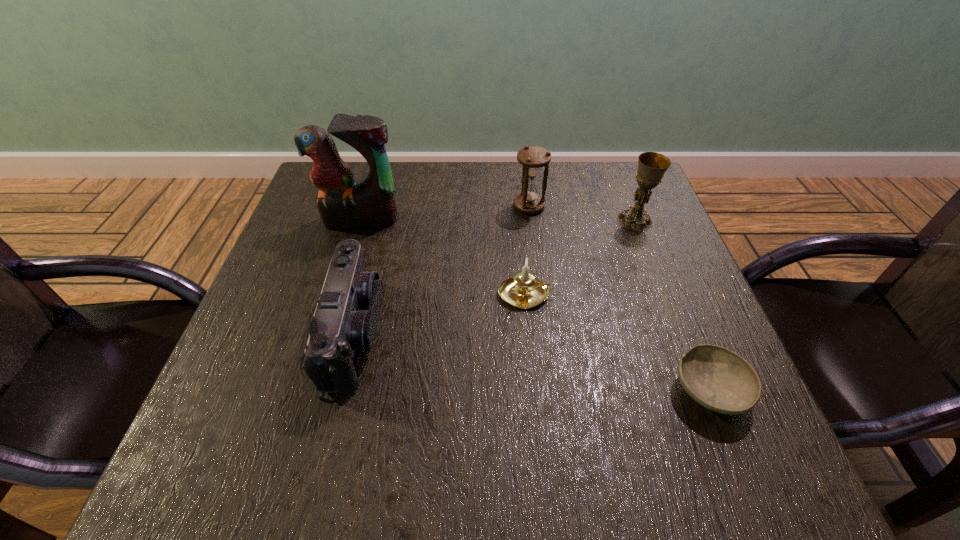
The height and width of the screenshot is (540, 960). In order to click on empty location between the hourglass and the bowl in this screenshot , I will do `click(619, 299)`.

The height and width of the screenshot is (540, 960). I want to click on vacant region between the bowl and the candle holder, so click(618, 342).

You are a GUI agent. You are given a task and a screenshot of the screen. Output one action in this format:
    pyautogui.click(x=<x>, y=<y>)
    Task: Click on the free space between the second shortest object and the hourglass
    The height and width of the screenshot is (540, 960).
    Given the screenshot: What is the action you would take?
    pyautogui.click(x=528, y=251)

This screenshot has width=960, height=540. What are the coordinates of `blank region between the hourglass and the parrot` in the screenshot? It's located at click(445, 213).

Where is `vacant space that's between the tallest object and the candle holder`? vacant space that's between the tallest object and the candle holder is located at coordinates (444, 257).

Choose which object is the fifth nearest neighbor to the bowl. Please provide its 2D coordinates. Your answer should be formatted as a tuple, i.e. [(x, y)], where the tuple contains the x and y coordinates of a point satisfying the conditions above.

[(342, 203)]

Where is `object identified as the fifth closest to the hourglass`? This screenshot has height=540, width=960. object identified as the fifth closest to the hourglass is located at coordinates (720, 380).

The width and height of the screenshot is (960, 540). What are the coordinates of `vacant area in the image that satisfies the following two spatial constraints: 1. on the front-facing side of the shortest object; 2. on the left side of the third shortest object` in the screenshot? It's located at (341, 391).

In order to click on vacant region that satisfies the following two spatial constraints: 1. at the face of the shortest object; 2. on the left side of the parrot in this screenshot , I will do `click(310, 391)`.

Image resolution: width=960 pixels, height=540 pixels. In order to click on vacant position in the image that satisfies the following two spatial constraints: 1. on the front-facing side of the third shortest object; 2. on the right side of the shortest object in this screenshot , I will do `click(341, 391)`.